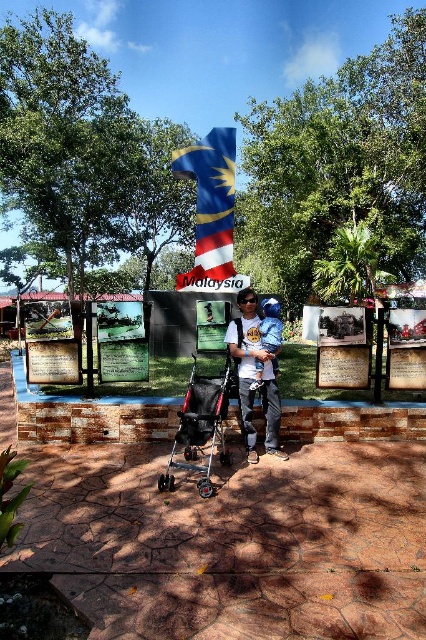
Question: Among these points, which one is farthest from the camera?

Choices:
 (A) (206, 221)
 (B) (196, 426)

Answer: (A)

Question: Which object is farther from the camera taking this photo?

Choices:
 (A) matte black backpack at center
 (B) blue denim pants at center
 (C) malaysian flag at center
 (D) black plastic baby carriage at center

Answer: (C)

Question: Considering the relative positions of black plastic baby carriage at center and blue denim pants at center in the image provided, where is black plastic baby carriage at center located with respect to blue denim pants at center?

Choices:
 (A) right
 (B) left

Answer: (B)

Question: Can you confirm if black plastic baby carriage at center is positioned to the right of blue denim pants at center?

Choices:
 (A) yes
 (B) no

Answer: (B)

Question: Does matte black backpack at center have a smaller size compared to blue denim pants at center?

Choices:
 (A) no
 (B) yes

Answer: (B)

Question: Among these points, which one is nearest to the camera?

Choices:
 (A) click(x=201, y=172)
 (B) click(x=233, y=326)

Answer: (B)